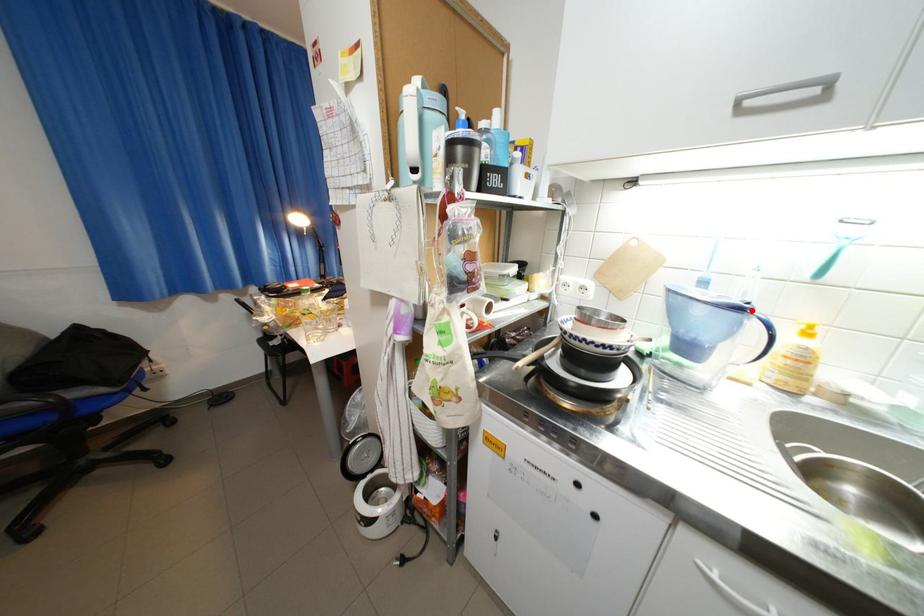
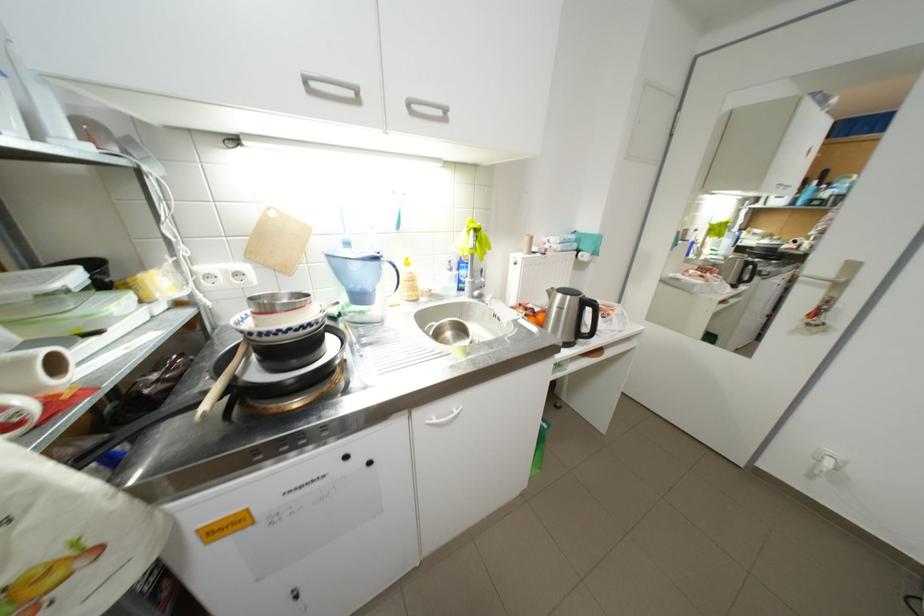
Question: I am providing you with two images of the same scene from different viewpoints. A red point is marked on the first image. At the location where the point appears in image 1, is it still visible in image 2?

Choices:
 (A) Yes
 (B) No

Answer: (A)